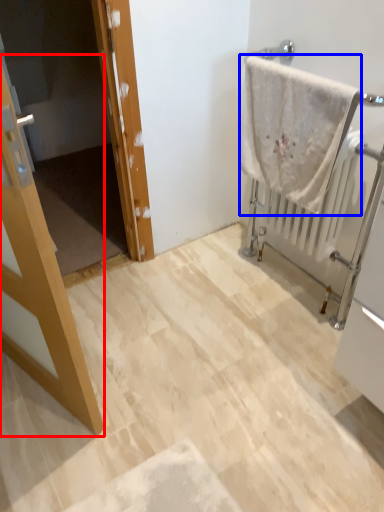
Question: Among these objects, which one is nearest to the camera, door (highlighted by a red box) or towel (highlighted by a blue box)?

Choices:
 (A) door
 (B) towel

Answer: (A)